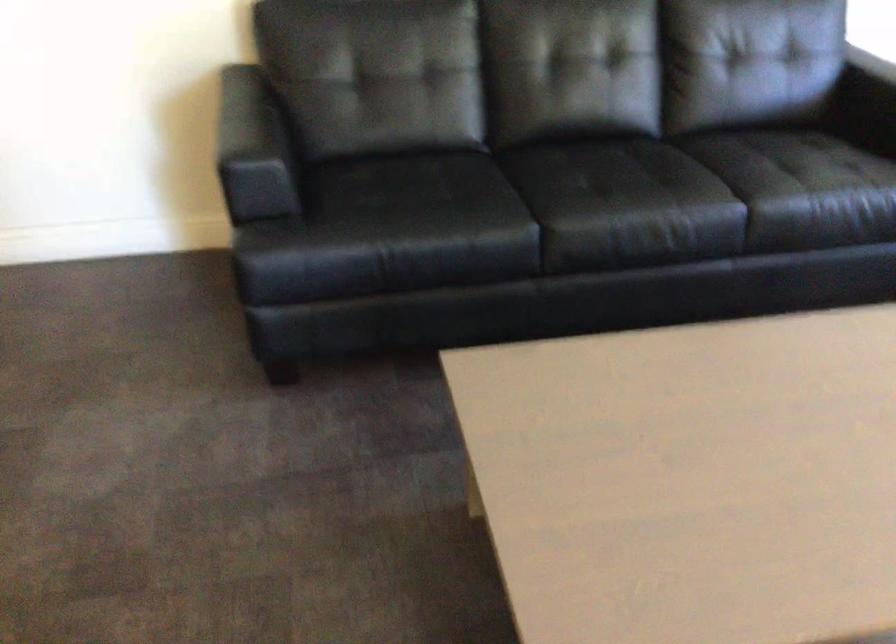
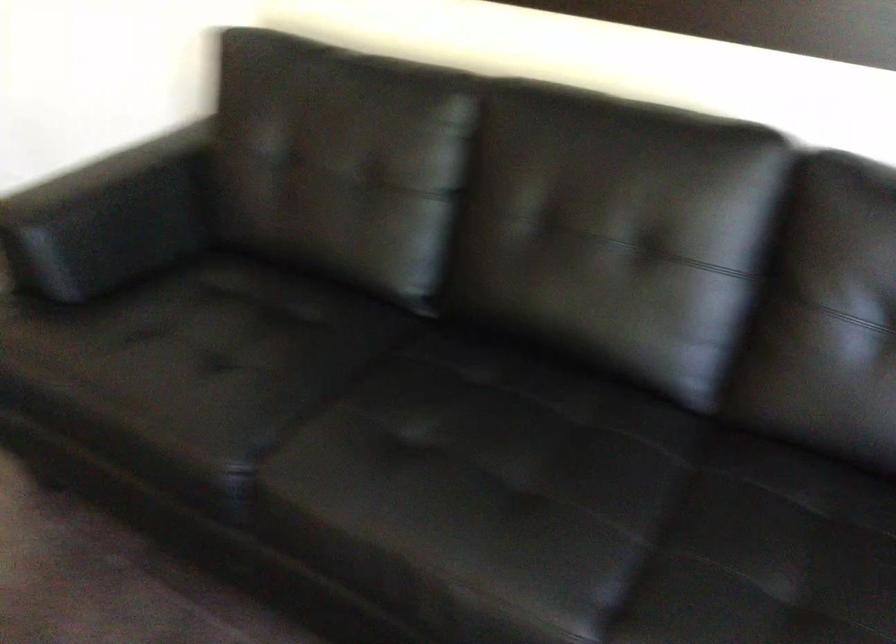
In the second image, find the point that corresponds to pixel 277 156 in the first image.

(108, 218)